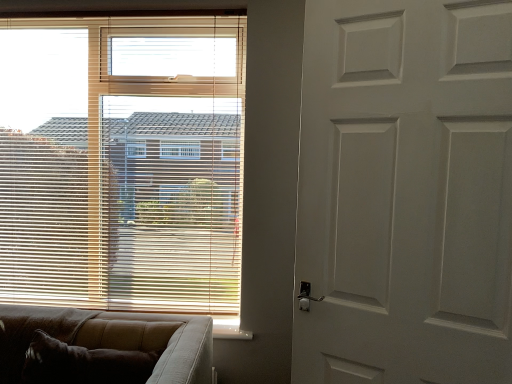
The width and height of the screenshot is (512, 384). Describe the element at coordinates (102, 346) in the screenshot. I see `brown textured couch at lower left` at that location.

Measure the distance between point (466, 265) and camera.

The depth of point (466, 265) is 3.98 feet.

The image size is (512, 384). Find the location of `white matte door at right`. white matte door at right is located at coordinates (405, 193).

What is the approximate width of wooden blinds at upper left?

The width of wooden blinds at upper left is 1.32 inches.

The image size is (512, 384). Identify the location of brown textured couch at lower left. (102, 346).

Is brown textured couch at lower left not within white matte door at right?

Indeed, brown textured couch at lower left is completely outside white matte door at right.

This screenshot has width=512, height=384. In order to click on door that appears above the brown textured couch at lower left (from a real-world perspective) in this screenshot , I will do `click(405, 193)`.

Does brown textured couch at lower left turn towards white matte door at right?

No, brown textured couch at lower left is not aimed at white matte door at right.

Looking at their sizes, would you say wooden blinds at upper left is wider or thinner than brown textured couch at lower left?

In the image, wooden blinds at upper left appears to be more narrow than brown textured couch at lower left.

From a real-world perspective, which is physically above, wooden blinds at upper left or brown textured couch at lower left?

From a 3D spatial view, wooden blinds at upper left is above.

Considering their positions, is wooden blinds at upper left located in front of or behind brown textured couch at lower left?

In the image, wooden blinds at upper left appears behind brown textured couch at lower left.

Is point (132, 128) behind point (99, 350)?

That is True.

Which object is positioned more to the left, white matte door at right or wooden blinds at upper left?

wooden blinds at upper left.

Is wooden blinds at upper left surrounded by white matte door at right?

No.

From the image's perspective, which is above, white matte door at right or wooden blinds at upper left?

wooden blinds at upper left.

Does wooden blinds at upper left come behind white matte door at right?

Yes.

Which of these two, wooden blinds at upper left or white matte door at right, is wider?

white matte door at right is wider.

Identify the location of door below the wooden blinds at upper left (from a real-world perspective). coord(405,193).

Is wooden blinds at upper left facing away from white matte door at right?

No, white matte door at right is not at the back of wooden blinds at upper left.

Can you confirm if white matte door at right is positioned to the right of brown textured couch at lower left?

Yes, white matte door at right is to the right of brown textured couch at lower left.

Measure the distance between white matte door at right and brown textured couch at lower left.

white matte door at right and brown textured couch at lower left are 82.22 centimeters apart.

Which of these two, white matte door at right or brown textured couch at lower left, is wider?

With larger width is brown textured couch at lower left.

What's the angular difference between white matte door at right and brown textured couch at lower left's facing directions?

26.1 degrees.

Consider the image. Between brown textured couch at lower left and wooden blinds at upper left, which one appears on the right side from the viewer's perspective?

brown textured couch at lower left is more to the right.

Consider the image. From a real-world perspective, is brown textured couch at lower left over wooden blinds at upper left?

No, from a real-world perspective, brown textured couch at lower left is not over wooden blinds at upper left

From the picture: Which object is thinner, brown textured couch at lower left or wooden blinds at upper left?

wooden blinds at upper left is thinner.

Does brown textured couch at lower left lie behind wooden blinds at upper left?

No, it is in front of wooden blinds at upper left.

You are a GUI agent. You are given a task and a screenshot of the screen. Output one action in this format:
    pyautogui.click(x=<x>, y=<y>)
    Task: Click on the studio couch on the left of white matte door at right
    This screenshot has height=384, width=512.
    Given the screenshot: What is the action you would take?
    pyautogui.click(x=102, y=346)

In the image, there is a brown textured couch at lower left. Where is `window blind above it (from the image's perspective)`? The width and height of the screenshot is (512, 384). window blind above it (from the image's perspective) is located at coordinates (122, 162).

Considering their positions, is brown textured couch at lower left positioned closer to white matte door at right than wooden blinds at upper left?

brown textured couch at lower left.

When comparing their distances from wooden blinds at upper left, does brown textured couch at lower left or white matte door at right seem closer?

brown textured couch at lower left is positioned closer to the anchor wooden blinds at upper left.

Looking at the image, which one is located closer to wooden blinds at upper left, white matte door at right or brown textured couch at lower left?

brown textured couch at lower left is closer to wooden blinds at upper left.

Considering their positions, is white matte door at right positioned further to brown textured couch at lower left than wooden blinds at upper left?

Among the two, white matte door at right is located further to brown textured couch at lower left.

Based on the photo, based on their spatial positions, is wooden blinds at upper left or brown textured couch at lower left further from white matte door at right?

wooden blinds at upper left is positioned further to the anchor white matte door at right.

Estimate the real-world distances between objects in this image. Which object is closer to brown textured couch at lower left, wooden blinds at upper left or white matte door at right?

wooden blinds at upper left.

Image resolution: width=512 pixels, height=384 pixels. Find the location of `studio couch between wooden blinds at upper left and white matte door at right`. studio couch between wooden blinds at upper left and white matte door at right is located at coordinates (102, 346).